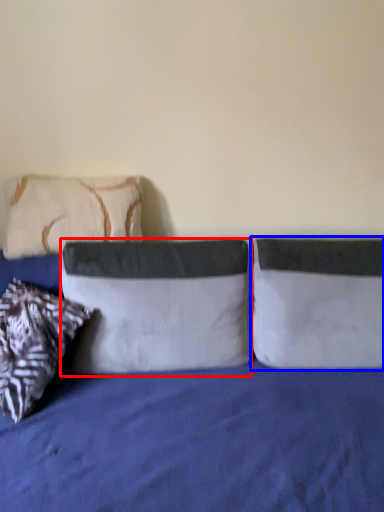
Question: Which object is closer to the camera taking this photo, pillow (highlighted by a red box) or pillow (highlighted by a blue box)?

Choices:
 (A) pillow
 (B) pillow

Answer: (A)